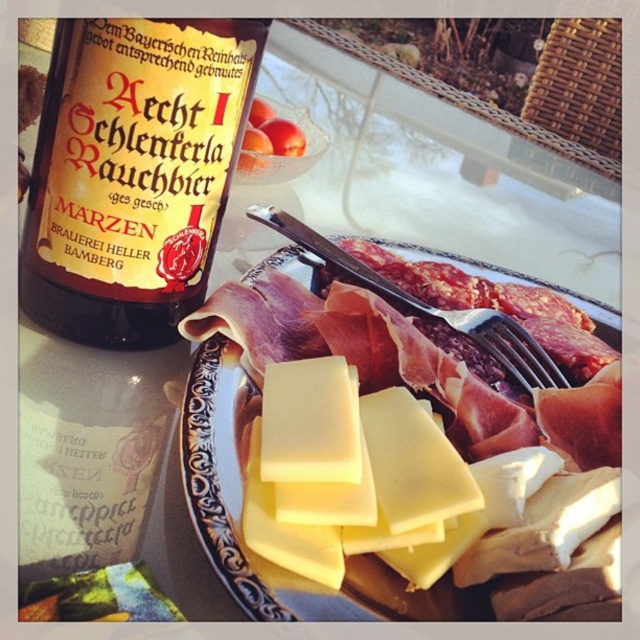
You are a bartender trying to place a coaster under the brown glass bottle at upper left and the yellow cheese at center. Which object requires a larger coaster to fully cover its base?

The yellow cheese at center requires a larger coaster since it is bigger than the brown glass bottle at upper left.

You are trying to decide which item to pick up first. The brown glass bottle at upper left and the yellow cheese at center are both on the table. Which one has a smaller diameter?

The brown glass bottle at upper left is thinner than the yellow cheese at center, so the brown glass bottle at upper left has a smaller diameter.